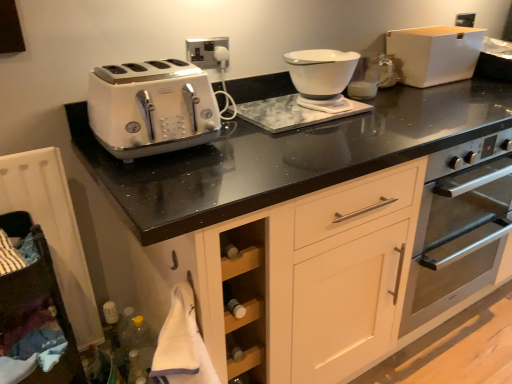
Describe the element at coordinates (35, 312) in the screenshot. This screenshot has height=384, width=512. I see `white wood cabinet at lower left` at that location.

You are a GUI agent. You are given a task and a screenshot of the screen. Output one action in this format:
    pyautogui.click(x=<x>, y=<y>)
    Task: Click on the white glossy toaster at left
    The height and width of the screenshot is (384, 512).
    Given the screenshot: What is the action you would take?
    pyautogui.click(x=152, y=108)

Describe the element at coordinates (322, 77) in the screenshot. I see `white glossy bowl at center` at that location.

Identify the location of white glossy bowl at upper center. Image resolution: width=512 pixels, height=384 pixels. (371, 77).

I want to click on kitchen appliance on the right of white glossy toaster at left, so click(x=434, y=54).

Is white matte storage box at upper right located outside white glossy toaster at left?

Yes, white matte storage box at upper right is located beyond the bounds of white glossy toaster at left.

How many degrees apart are the facing directions of white matte storage box at upper right and white glossy toaster at left?

The angle between the facing direction of white matte storage box at upper right and the facing direction of white glossy toaster at left is 1.95 degrees.

Is white matte storage box at upper right touching white glossy toaster at left?

white matte storage box at upper right is not next to white glossy toaster at left, and they're not touching.

How much distance is there between white glossy bowl at upper center and white glossy toaster at left?

A distance of 29.39 inches exists between white glossy bowl at upper center and white glossy toaster at left.

Is white glossy bowl at upper center not near white glossy toaster at left?

No, white glossy bowl at upper center is in close proximity to white glossy toaster at left.

Which is more to the left, white glossy bowl at upper center or white glossy toaster at left?

white glossy toaster at left.

Can you tell me how much white glossy bowl at upper center and white glossy toaster at left differ in facing direction?

white glossy bowl at upper center and white glossy toaster at left are facing 2.86 degrees away from each other.

You are a GUI agent. You are given a task and a screenshot of the screen. Output one action in this format:
    pyautogui.click(x=<x>, y=<y>)
    Task: Click on the cabinetry below the white glossy bowl at center (from a real-world perspective)
    The height and width of the screenshot is (384, 512).
    Given the screenshot: What is the action you would take?
    (35, 312)

Is point (331, 111) closer to camera compared to point (47, 315)?

No, it is behind (47, 315).

How different are the orientations of white glossy bowl at center and white wood cabinet at lower left in degrees?

They differ by 0.238 degrees in their facing directions.

Is white glossy toaster at left situated inside white glossy bowl at upper center or outside?

white glossy toaster at left is not enclosed by white glossy bowl at upper center.

Is white glossy toaster at left taller or shorter than white glossy bowl at upper center?

Considering their sizes, white glossy toaster at left has more height than white glossy bowl at upper center.

Does white glossy toaster at left turn towards white glossy bowl at upper center?

No, white glossy toaster at left does not turn towards white glossy bowl at upper center.

Where is `coffee machine behind the white glossy toaster at left`? Image resolution: width=512 pixels, height=384 pixels. coffee machine behind the white glossy toaster at left is located at coordinates (371, 77).

Locate an element on the screen. Image resolution: width=512 pixels, height=384 pixels. cabinetry that is in front of the white matte storage box at upper right is located at coordinates (35, 312).

Based on the photo, how many degrees apart are the facing directions of white matte storage box at upper right and white wood cabinet at lower left?

They differ by 0.0625 degrees in their facing directions.

Based on the photo, does white matte storage box at upper right touch white wood cabinet at lower left?

white matte storage box at upper right and white wood cabinet at lower left are clearly separated.

Can you tell me how much white wood cabinet at lower left and white matte storage box at upper right differ in facing direction?

They differ by 0.0625 degrees in their facing directions.

From a real-world perspective, which is physically below, white wood cabinet at lower left or white matte storage box at upper right?

From a 3D spatial view, white wood cabinet at lower left is below.

Which of these two, white wood cabinet at lower left or white matte storage box at upper right, is thinner?

white matte storage box at upper right.

Between point (29, 271) and point (426, 78), which one is positioned behind?

Point (426, 78)

Based on the photo, could white glossy bowl at upper center be considered to be inside white glossy bowl at center?

No, white glossy bowl at upper center is located outside of white glossy bowl at center.

Is white glossy bowl at center wider than white glossy bowl at upper center?

Yes.

From a real-world perspective, is white glossy bowl at center located beneath white glossy bowl at upper center?

No, from a real-world perspective, white glossy bowl at center is not beneath white glossy bowl at upper center.

Between white glossy bowl at center and white glossy bowl at upper center, which one appears on the right side from the viewer's perspective?

white glossy bowl at upper center is more to the right.

Find the location of `kitchen appliance that is on the right side of white glossy toaster at left`. kitchen appliance that is on the right side of white glossy toaster at left is located at coordinates (434, 54).

Find the location of `toaster in front of the white glossy bowl at upper center`. toaster in front of the white glossy bowl at upper center is located at coordinates (152, 108).

When comparing their distances from white matte storage box at upper right, does white glossy bowl at center or white wood cabinet at lower left seem closer?

Based on the image, white glossy bowl at center appears to be nearer to white matte storage box at upper right.

When comparing their distances from white glossy bowl at upper center, does white glossy toaster at left or white glossy bowl at center seem further?

Among the two, white glossy toaster at left is located further to white glossy bowl at upper center.

When comparing their distances from white glossy toaster at left, does white glossy bowl at center or white wood cabinet at lower left seem further?

Based on the image, white glossy bowl at center appears to be further to white glossy toaster at left.

From the image, which object appears to be nearer to white wood cabinet at lower left, white glossy toaster at left or white matte storage box at upper right?

white glossy toaster at left.

Considering their positions, is white glossy bowl at center positioned further to white matte storage box at upper right than white glossy toaster at left?

Among the two, white glossy toaster at left is located further to white matte storage box at upper right.

Looking at the image, which one is located closer to white wood cabinet at lower left, white glossy bowl at upper center or white glossy toaster at left?

white glossy toaster at left.

When comparing their distances from white glossy bowl at upper center, does white glossy bowl at center or white glossy toaster at left seem closer?

white glossy bowl at center lies closer to white glossy bowl at upper center than the other object.

Looking at the image, which one is located further to white glossy bowl at upper center, white glossy bowl at center or white matte storage box at upper right?

Among the two, white glossy bowl at center is located further to white glossy bowl at upper center.

Locate an element on the screen. This screenshot has height=384, width=512. food processor located between white glossy toaster at left and white glossy bowl at upper center in the left-right direction is located at coordinates (322, 77).

In order to click on coffee machine between white glossy toaster at left and white matte storage box at upper right in the horizontal direction in this screenshot , I will do `click(371, 77)`.

I want to click on toaster between white wood cabinet at lower left and white matte storage box at upper right from left to right, so click(152, 108).

You are a GUI agent. You are given a task and a screenshot of the screen. Output one action in this format:
    pyautogui.click(x=<x>, y=<y>)
    Task: Click on the food processor between white wood cabinet at lower left and white glossy bowl at upper center
    Image resolution: width=512 pixels, height=384 pixels.
    Given the screenshot: What is the action you would take?
    pyautogui.click(x=322, y=77)